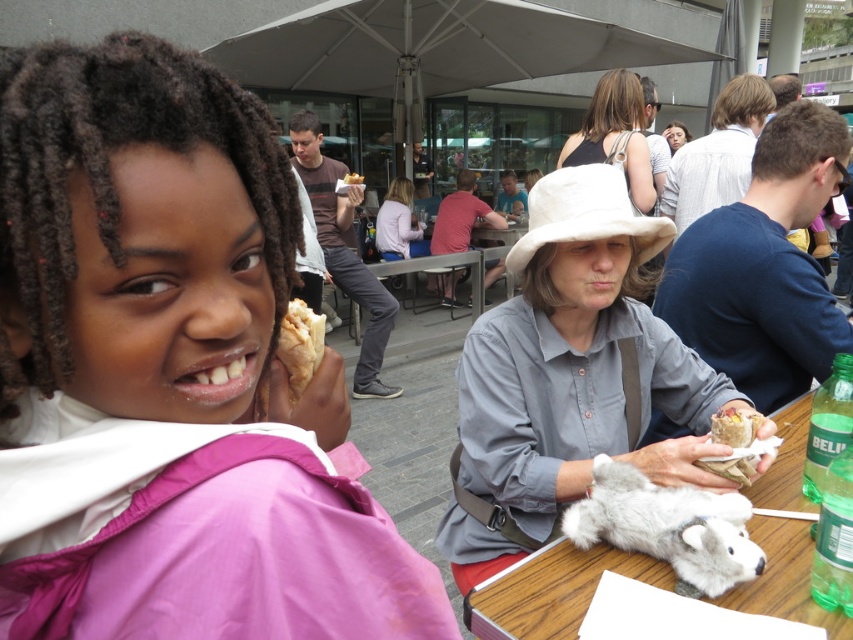
Question: Does pink fabric jacket at upper left have a greater width compared to fuzzy white stuffed animal at center?

Choices:
 (A) no
 (B) yes

Answer: (B)

Question: Does pink fabric jacket at upper left have a larger size compared to fuzzy white stuffed animal at center?

Choices:
 (A) yes
 (B) no

Answer: (A)

Question: Can you confirm if fuzzy white stuffed animal at center is positioned below bread-like at center?

Choices:
 (A) no
 (B) yes

Answer: (B)

Question: Which object is farther from the camera taking this photo?

Choices:
 (A) matte brown sandwich at lower right
 (B) fuzzy white stuffed animal at center

Answer: (A)

Question: Among these objects, which one is nearest to the camera?

Choices:
 (A) fuzzy white stuffed animal at center
 (B) matte brown sandwich at lower right

Answer: (A)

Question: Which point is farther from the camera taking this photo?

Choices:
 (A) (712, 436)
 (B) (357, 177)

Answer: (B)